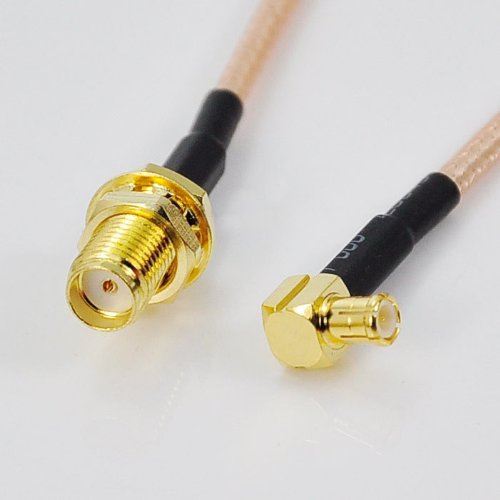
Locate an element on the screen. This screenshot has height=500, width=500. cable is located at coordinates (117, 277).